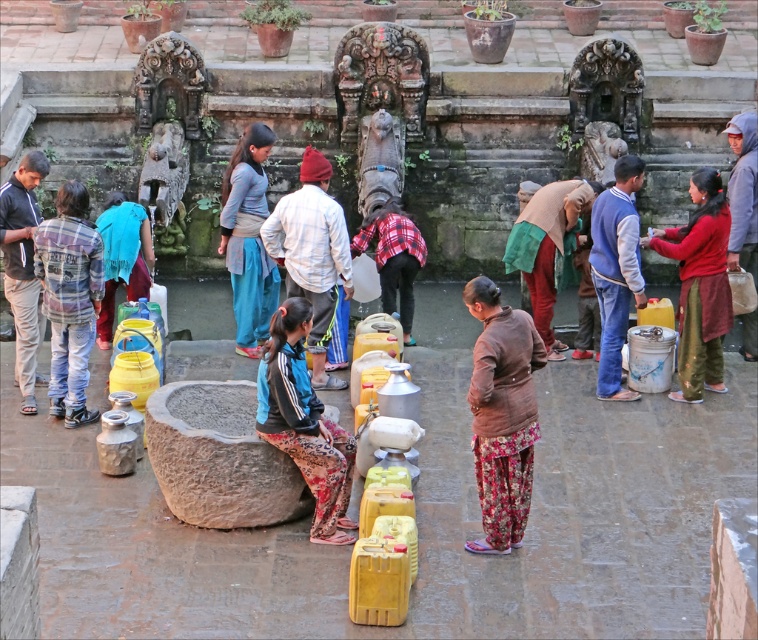
You are a photographer standing in the courtyard and want to take a photo that includes both the red cotton dress at right and the brown fabric headscarf at center. Which object should you adjust your camera angle to focus on first to ensure both are in frame?

The red cotton dress at right is much taller than the brown fabric headscarf at center, so you should focus on the red cotton dress at right first to ensure both are in frame.